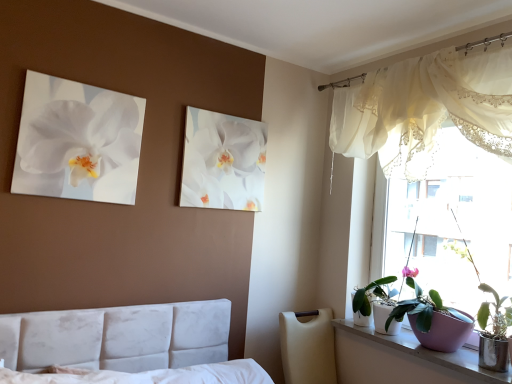
Question: From a real-world perspective, is translucent fabric at upper right beneath white glossy orchid at upper center, which appears as the 2th flower when viewed from the front?

Choices:
 (A) no
 (B) yes

Answer: (B)

Question: Considering the relative sizes of translucent fabric at upper right and white glossy orchid at upper center, the second flower when ordered from left to right, in the image provided, is translucent fabric at upper right shorter than white glossy orchid at upper center, the second flower when ordered from left to right,?

Choices:
 (A) no
 (B) yes

Answer: (A)

Question: Considering the relative positions of translucent fabric at upper right and white glossy orchid at upper center, which appears as the 2th flower when viewed from the front, in the image provided, is translucent fabric at upper right to the right of white glossy orchid at upper center, which appears as the 2th flower when viewed from the front, from the viewer's perspective?

Choices:
 (A) yes
 (B) no

Answer: (A)

Question: Is translucent fabric at upper right wider than white glossy orchid at upper center, the 1th flower when ordered from right to left?

Choices:
 (A) yes
 (B) no

Answer: (A)

Question: Is translucent fabric at upper right not inside white glossy orchid at upper center, the second flower when ordered from left to right?

Choices:
 (A) yes
 (B) no

Answer: (A)

Question: Can you confirm if translucent fabric at upper right is taller than white glossy orchid at upper center, the second flower when ordered from left to right?

Choices:
 (A) yes
 (B) no

Answer: (A)

Question: Is white glossy orchid at upper left, placed as the 1th flower when sorted from left to right, further to the viewer compared to translucent fabric at upper right?

Choices:
 (A) no
 (B) yes

Answer: (A)

Question: Can you confirm if white glossy orchid at upper left, placed as the 1th flower when sorted from left to right, is shorter than translucent fabric at upper right?

Choices:
 (A) yes
 (B) no

Answer: (A)

Question: From a real-world perspective, is white glossy orchid at upper left, the 1th flower positioned from the front, located higher than translucent fabric at upper right?

Choices:
 (A) no
 (B) yes

Answer: (B)

Question: Is white glossy orchid at upper left, the 1th flower positioned from the front, facing away from translucent fabric at upper right?

Choices:
 (A) yes
 (B) no

Answer: (B)

Question: Considering the relative sizes of white glossy orchid at upper left, the second flower viewed from the back, and translucent fabric at upper right in the image provided, is white glossy orchid at upper left, the second flower viewed from the back, taller than translucent fabric at upper right?

Choices:
 (A) yes
 (B) no

Answer: (B)

Question: Can you confirm if white glossy orchid at upper left, the second flower viewed from the back, is wider than translucent fabric at upper right?

Choices:
 (A) no
 (B) yes

Answer: (A)

Question: Is smooth white windowsill at lower right at the right side of white glossy pot at window, arranged as the first houseplant when viewed from the back?

Choices:
 (A) yes
 (B) no

Answer: (A)